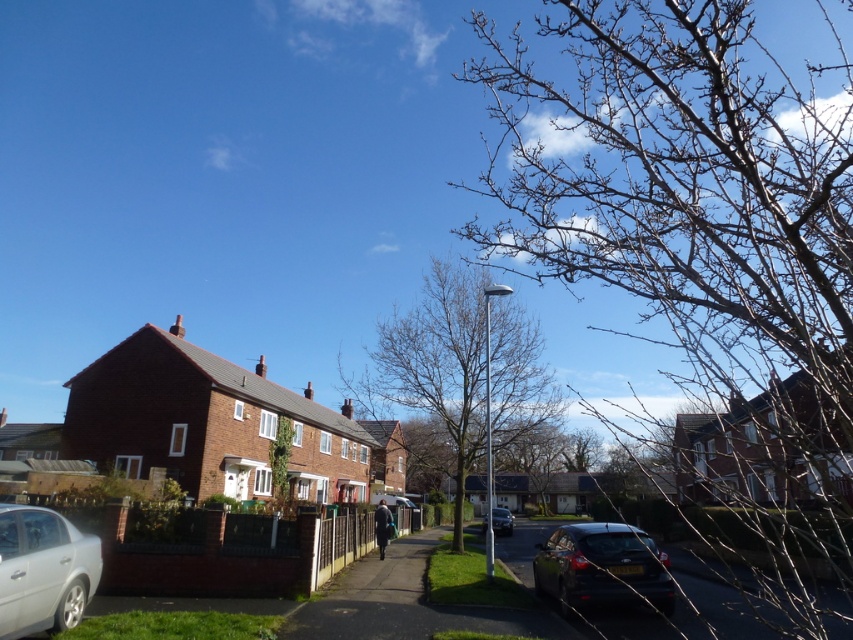
Question: Which object is closer to the camera taking this photo?

Choices:
 (A) bare branches at center
 (B) shiny black sedan at center
 (C) shiny black car at lower right

Answer: (C)

Question: Which object appears farthest from the camera in this image?

Choices:
 (A) bare branches at center
 (B) silver metallic car at lower left
 (C) shiny black sedan at center
 (D) bare branches at upper right

Answer: (C)

Question: Is bare branches at center wider than silver metallic car at lower left?

Choices:
 (A) yes
 (B) no

Answer: (A)

Question: Can you confirm if silver metallic car at lower left is thinner than shiny black car at lower right?

Choices:
 (A) no
 (B) yes

Answer: (B)

Question: From the image, what is the correct spatial relationship of bare branches at center in relation to shiny black sedan at center?

Choices:
 (A) below
 (B) above

Answer: (B)

Question: Estimate the real-world distances between objects in this image. Which object is farther from the shiny black sedan at center?

Choices:
 (A) bare branches at center
 (B) silver metallic car at lower left

Answer: (B)